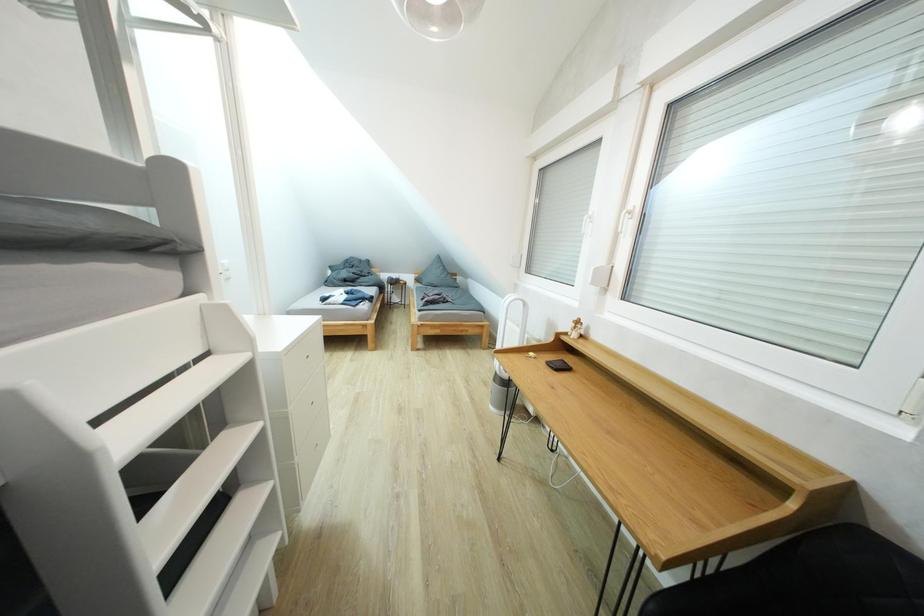
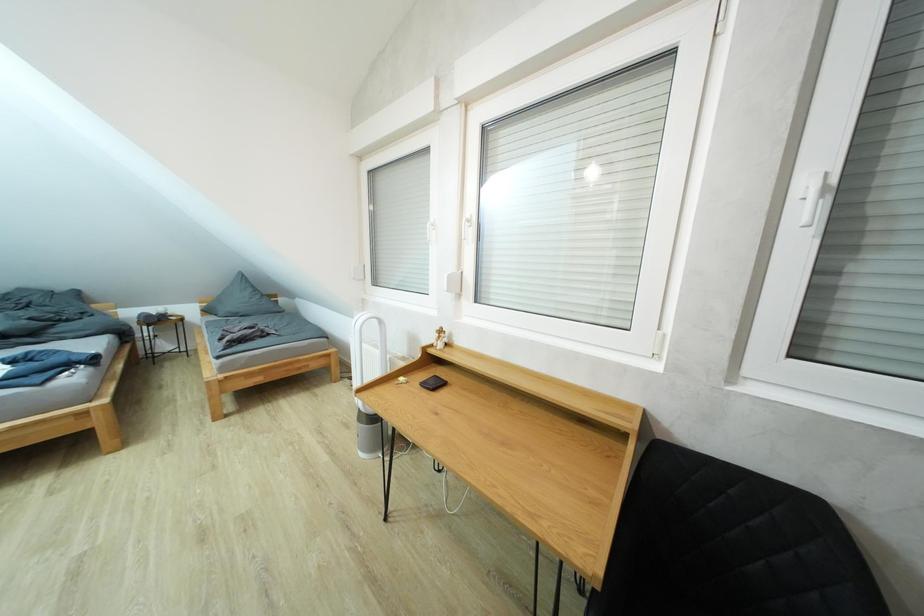
Question: Based on the continuous images, in which direction is the camera rotating? Reply with the corresponding letter.

Choices:
 (A) Left
 (B) Right
 (C) Up
 (D) Down

Answer: (B)